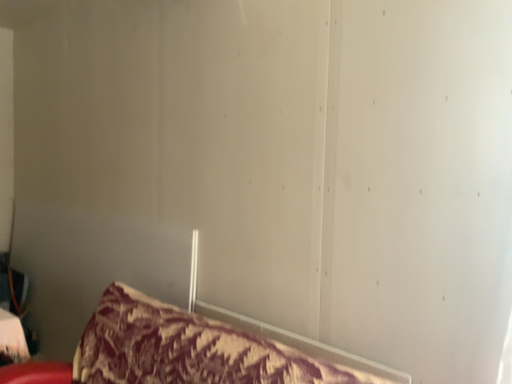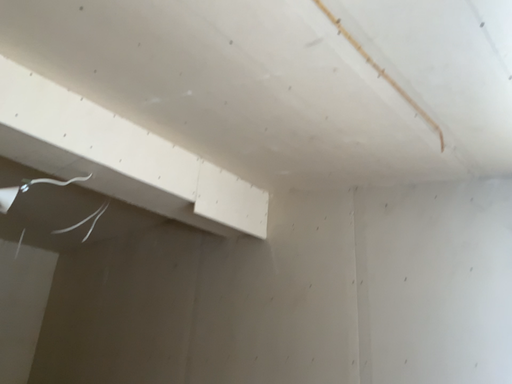
Question: How did the camera likely rotate when shooting the video?

Choices:
 (A) rotated upward
 (B) rotated downward

Answer: (A)